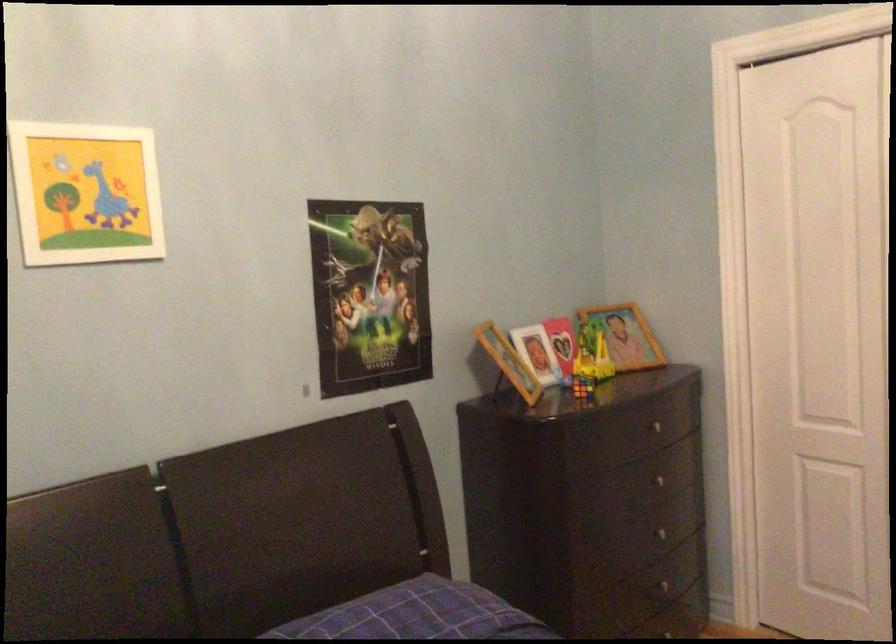
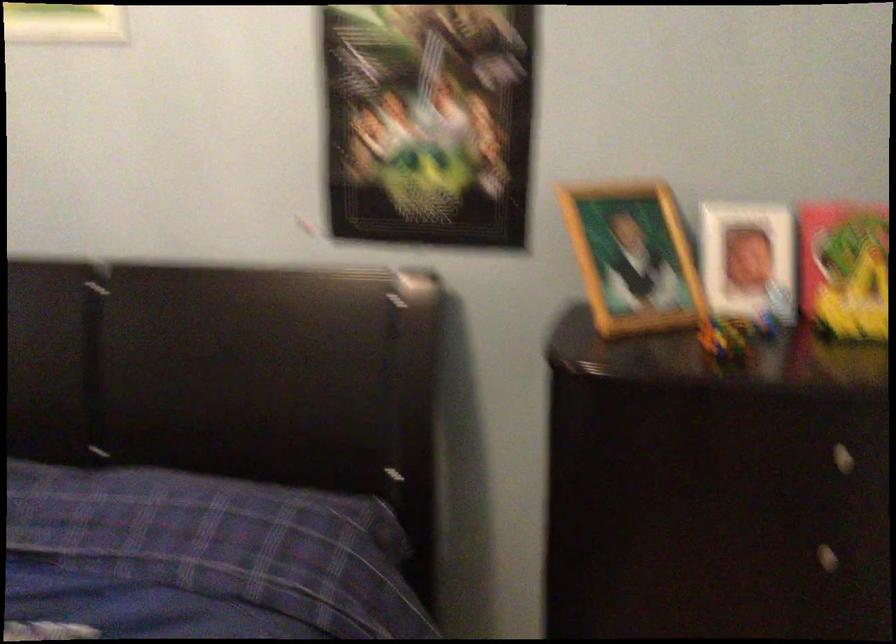
Where in the second image is the point corresponding to pixel 657 489 from the first image?

(807, 554)